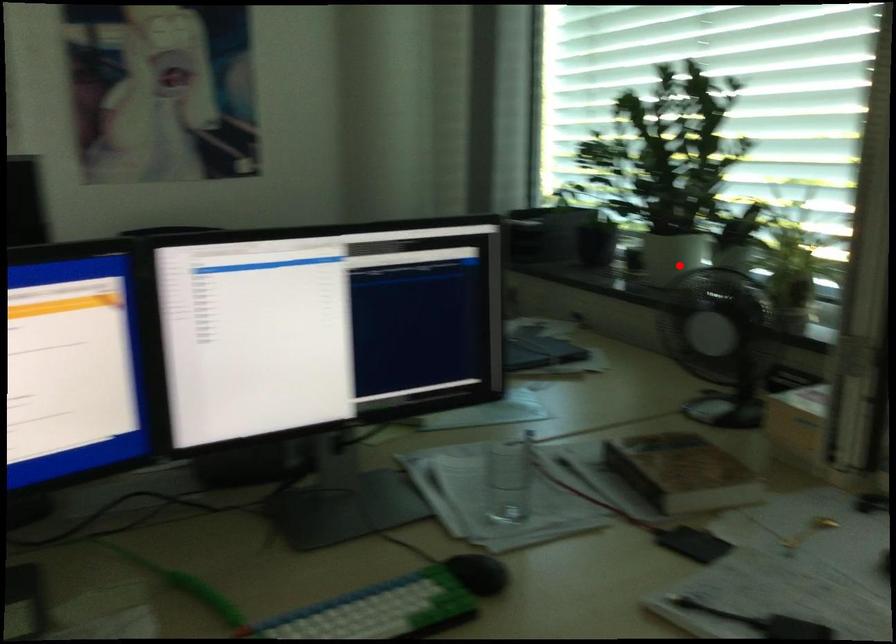
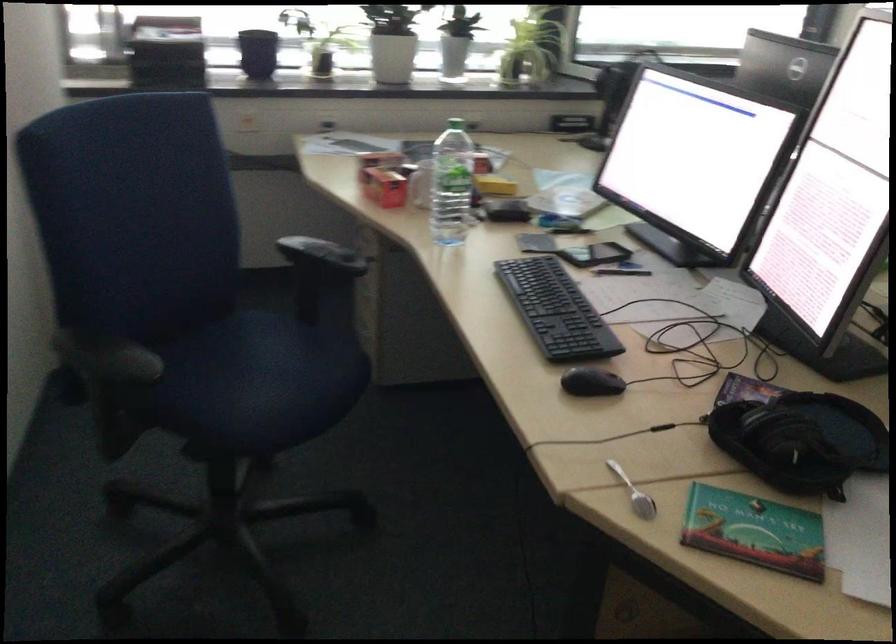
Question: I am providing you with two images of the same scene from different viewpoints. In image1, a red point is highlighted. Considering the same 3D point in image2, which of the following is correct?

Choices:
 (A) It is closer
 (B) It is farther

Answer: (B)